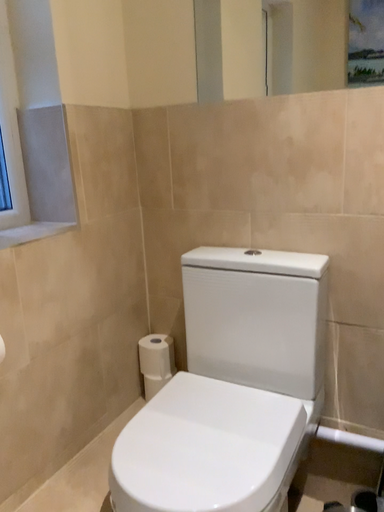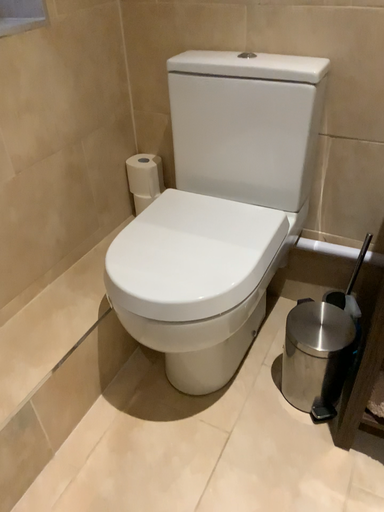
Question: How did the camera likely rotate when shooting the video?

Choices:
 (A) rotated upward
 (B) rotated downward

Answer: (B)